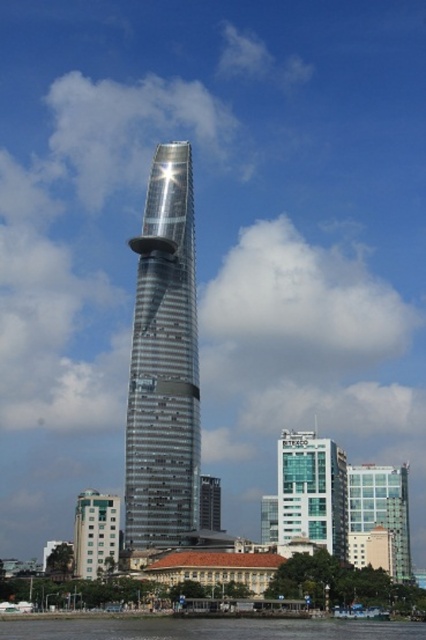
Question: Can you confirm if glassy teal skyscraper at center is smaller than glassy transparent building at center?

Choices:
 (A) no
 (B) yes

Answer: (B)

Question: Estimate the real-world distances between objects in this image. Which object is closer to the transparent water at lower center?

Choices:
 (A) glassy transparent building at center
 (B) silver metallic skyscraper at center

Answer: (B)

Question: Which object appears farthest from the camera in this image?

Choices:
 (A) glassy transparent building at center
 (B) glassy teal skyscraper at center
 (C) transparent water at lower center
 (D) glassy metallic skyscraper at center

Answer: (D)

Question: Does silver metallic skyscraper at center appear under glassy teal skyscraper at center?

Choices:
 (A) yes
 (B) no

Answer: (B)

Question: Is silver metallic skyscraper at center further to the viewer compared to glassy metallic skyscraper at center?

Choices:
 (A) no
 (B) yes

Answer: (A)

Question: Among these objects, which one is nearest to the camera?

Choices:
 (A) green glass building at lower left
 (B) glassy transparent building at center

Answer: (A)